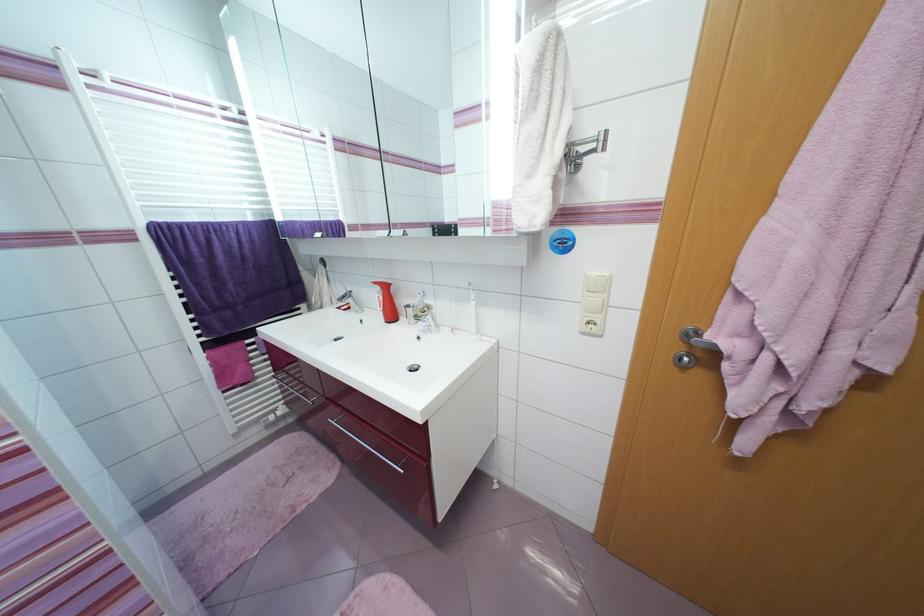
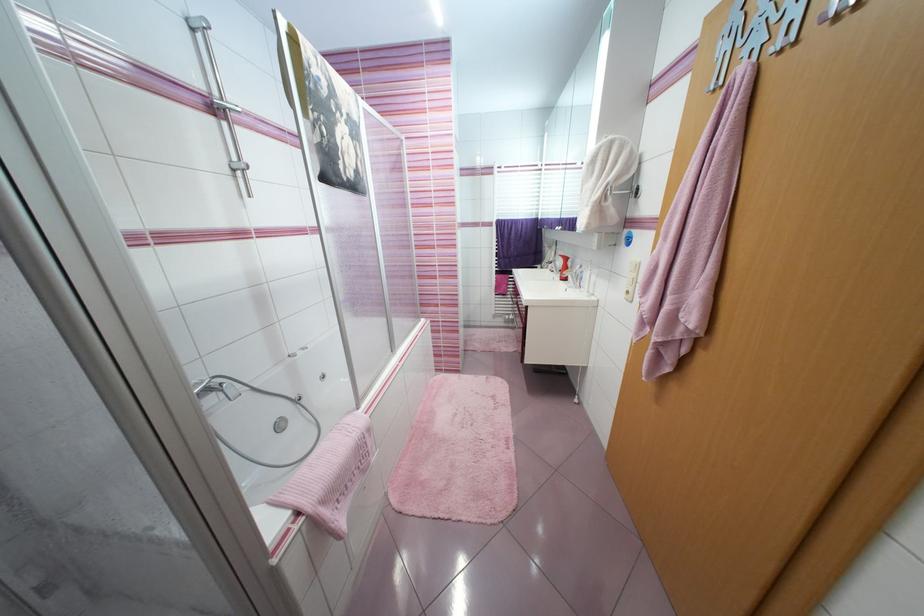
In the second image, find the point that corresponds to [273,204] in the first image.

(543, 211)